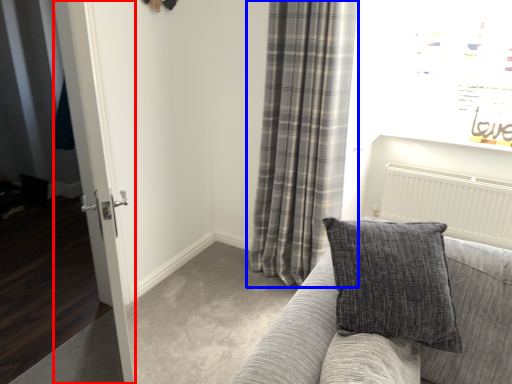
Question: Which object appears closest to the camera in this image, glass door (highlighted by a red box) or curtain (highlighted by a blue box)?

Choices:
 (A) glass door
 (B) curtain

Answer: (A)